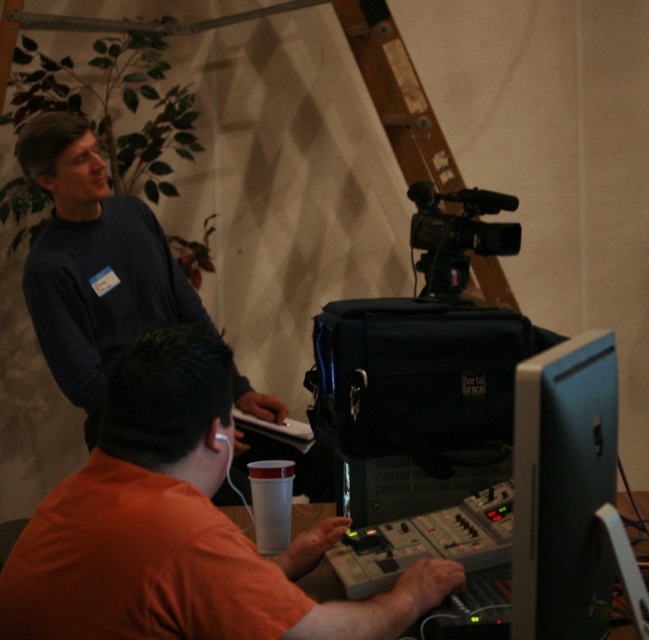
Can you confirm if orange cotton shirt at center is positioned below matte black monitor at lower right?

Correct, orange cotton shirt at center is located below matte black monitor at lower right.

Between point (154, 493) and point (574, 632), which one is positioned in front?

Positioned in front is point (574, 632).

This screenshot has width=649, height=640. Describe the element at coordinates (178, 528) in the screenshot. I see `orange cotton shirt at center` at that location.

In order to click on orange cotton shirt at center in this screenshot , I will do `click(178, 528)`.

Between orange cotton shirt at center and black plastic video camera at upper right, which one has less height?

black plastic video camera at upper right

Between point (201, 349) and point (421, 212), which one is positioned behind?

Positioned behind is point (421, 212).

The height and width of the screenshot is (640, 649). Find the location of `orange cotton shirt at center`. orange cotton shirt at center is located at coordinates (178, 528).

Between point (75, 320) and point (461, 220), which one is positioned behind?

Positioned behind is point (461, 220).

From the picture: Is dark blue sweater at upper left shorter than black plastic video camera at upper right?

No.

Between point (82, 355) and point (463, 205), which one is positioned in front?

Point (82, 355) is in front.

The height and width of the screenshot is (640, 649). Identify the location of dark blue sweater at upper left. (92, 262).